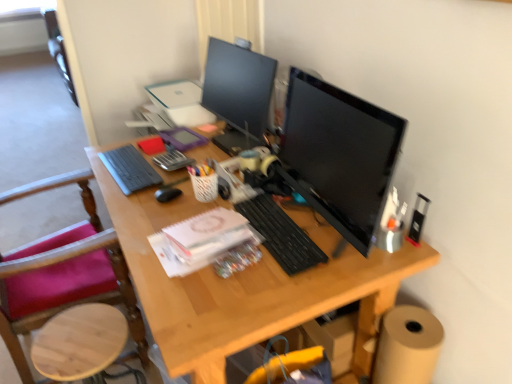
Question: Considering the relative positions of metallic black stapler at right, which appears as the second stationery when viewed from the top, and matte black computer tower at center in the image provided, is metallic black stapler at right, which appears as the second stationery when viewed from the top, to the right of matte black computer tower at center from the viewer's perspective?

Choices:
 (A) yes
 (B) no

Answer: (A)

Question: Can you confirm if metallic black stapler at right, acting as the second stationery starting from the back, is positioned to the left of matte black computer tower at center?

Choices:
 (A) no
 (B) yes

Answer: (A)

Question: Is metallic black stapler at right, the first stationery positioned from the bottom, bigger than matte black computer tower at center?

Choices:
 (A) no
 (B) yes

Answer: (A)

Question: From the image's perspective, is metallic black stapler at right, the first stationery positioned from the bottom, below matte black computer tower at center?

Choices:
 (A) no
 (B) yes

Answer: (B)

Question: Is metallic black stapler at right, arranged as the first stationery when viewed from the right, facing towards matte black computer tower at center?

Choices:
 (A) yes
 (B) no

Answer: (A)

Question: Looking at the image, does matte black monitor at upper center, which is the first computer monitor in back-to-front order, seem bigger or smaller compared to black glossy monitor at center, the 2th computer monitor positioned from the back?

Choices:
 (A) big
 (B) small

Answer: (A)

Question: From a real-world perspective, is matte black monitor at upper center, which is the first computer monitor in back-to-front order, positioned above or below black glossy monitor at center, which ranks as the first computer monitor in front-to-back order?

Choices:
 (A) above
 (B) below

Answer: (B)

Question: Is matte black monitor at upper center, which appears as the second computer monitor when viewed from the front, in front of or behind black glossy monitor at center, the 2th computer monitor positioned from the back, in the image?

Choices:
 (A) front
 (B) behind

Answer: (B)

Question: Choose the correct answer: Is matte black monitor at upper center, which appears as the second computer monitor when viewed from the front, inside black glossy monitor at center, which ranks as the first computer monitor in front-to-back order, or outside it?

Choices:
 (A) outside
 (B) inside

Answer: (A)

Question: Looking at the image, does wooden at left seem bigger or smaller compared to translucent plastic pen holder at center, which ranks as the 1th stationery in back-to-front order?

Choices:
 (A) big
 (B) small

Answer: (A)

Question: In the image, is wooden at left positioned in front of or behind translucent plastic pen holder at center, placed as the 2th stationery when sorted from front to back?

Choices:
 (A) front
 (B) behind

Answer: (A)

Question: Is wooden at left inside the boundaries of translucent plastic pen holder at center, which ranks as the 1th stationery in back-to-front order, or outside?

Choices:
 (A) inside
 (B) outside

Answer: (B)

Question: From their relative heights in the image, would you say wooden at left is taller or shorter than translucent plastic pen holder at center, acting as the first stationery starting from the top?

Choices:
 (A) tall
 (B) short

Answer: (A)

Question: Is metallic black stapler at right, the first stationery positioned from the bottom, in front of or behind matte black monitor at upper center, which appears as the second computer monitor when viewed from the front, in the image?

Choices:
 (A) front
 (B) behind

Answer: (A)

Question: From their relative heights in the image, would you say metallic black stapler at right, which appears as the second stationery when viewed from the top, is taller or shorter than matte black monitor at upper center, which appears as the second computer monitor when viewed from the front?

Choices:
 (A) short
 (B) tall

Answer: (A)